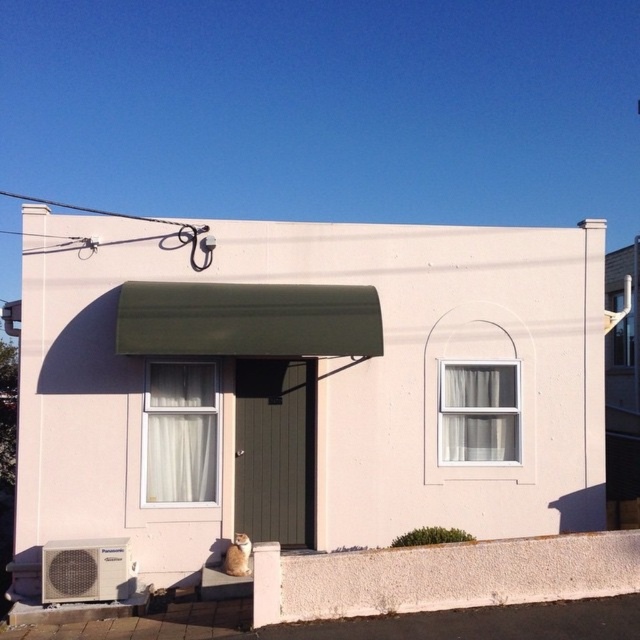
Who is shorter, white sheer curtain at center or white sheer curtain at upper right?

Standing shorter between the two is white sheer curtain at upper right.

Who is taller, white sheer curtain at center or white sheer curtain at upper right?

With more height is white sheer curtain at center.

Which is behind, point (179, 388) or point (472, 364)?

The point (472, 364) is behind.

This screenshot has width=640, height=640. Identify the location of white sheer curtain at center. (180, 433).

Can you confirm if white matte shed at center is taller than white sheer curtain at upper right?

In fact, white matte shed at center may be shorter than white sheer curtain at upper right.

Who is higher up, white matte shed at center or white sheer curtain at upper right?

white matte shed at center is above.

In order to click on white matte shed at center in this screenshot , I will do `click(301, 381)`.

Locate an element on the screen. The width and height of the screenshot is (640, 640). white matte shed at center is located at coordinates (301, 381).

Who is taller, white matte shed at center or white sheer curtain at center?

white sheer curtain at center is taller.

Can you confirm if white matte shed at center is positioned to the left of white sheer curtain at center?

Indeed, white matte shed at center is positioned on the left side of white sheer curtain at center.

The width and height of the screenshot is (640, 640). Describe the element at coordinates (301, 381) in the screenshot. I see `white matte shed at center` at that location.

What are the coordinates of `white matte shed at center` in the screenshot? It's located at (301, 381).